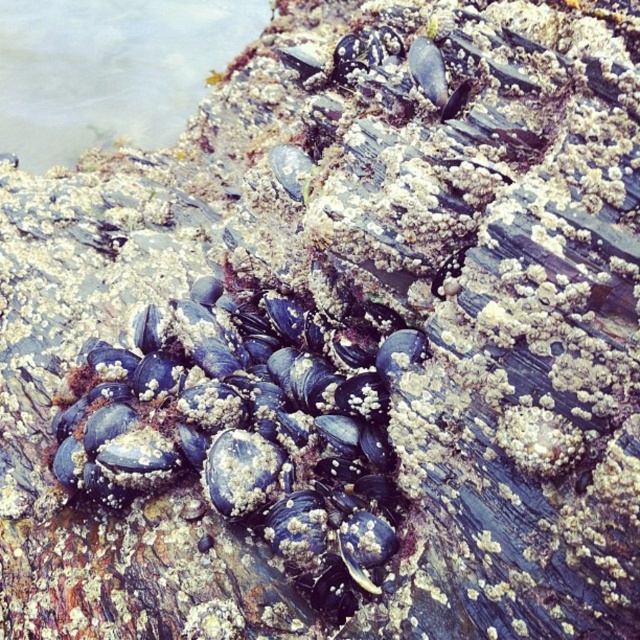
Question: Which object appears farthest from the camera in this image?

Choices:
 (A) clear water at upper left
 (B) blue matte shells at center

Answer: (A)

Question: Is blue matte shells at center bigger than clear water at upper left?

Choices:
 (A) yes
 (B) no

Answer: (B)

Question: Among these points, which one is nearest to the camera?

Choices:
 (A) (40, 12)
 (B) (193, 369)

Answer: (B)

Question: Which of the following is the closest to the observer?

Choices:
 (A) (150, 392)
 (B) (193, 80)

Answer: (A)

Question: Is blue matte shells at center smaller than clear water at upper left?

Choices:
 (A) no
 (B) yes

Answer: (B)

Question: Is blue matte shells at center thinner than clear water at upper left?

Choices:
 (A) yes
 (B) no

Answer: (A)